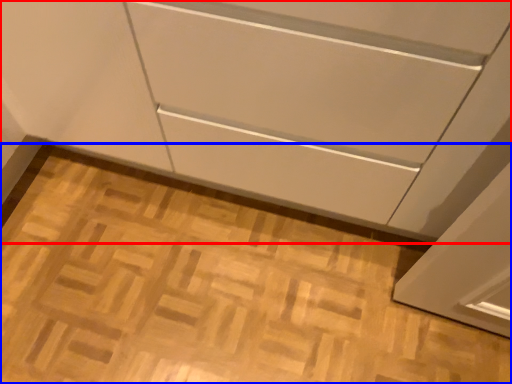
Question: Which object is closer to the camera taking this photo, cabinetry (highlighted by a red box) or plain (highlighted by a blue box)?

Choices:
 (A) cabinetry
 (B) plain

Answer: (A)